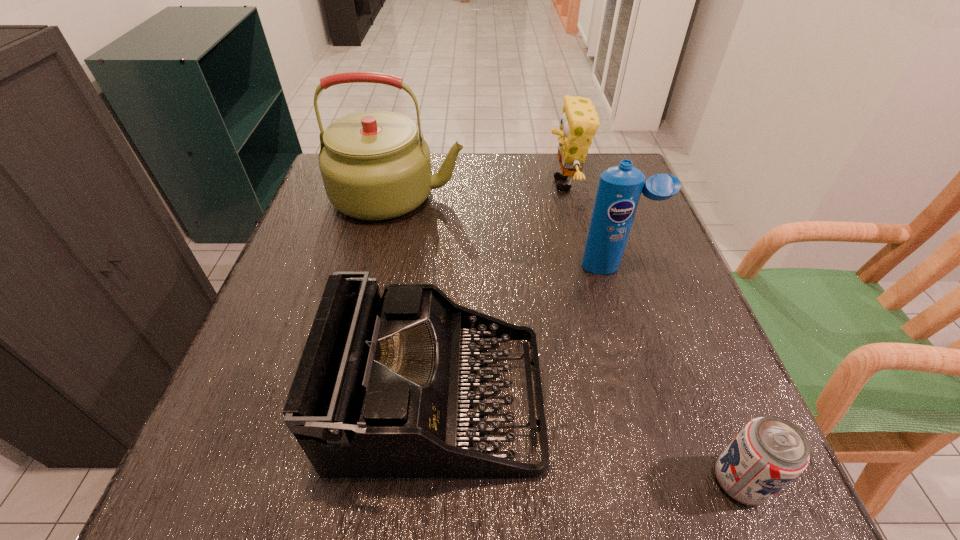
Locate an element on the screen. The width and height of the screenshot is (960, 540). the tallest object is located at coordinates pyautogui.click(x=374, y=165).

Identify the location of shampoo. The image size is (960, 540). (620, 187).

Image resolution: width=960 pixels, height=540 pixels. Identify the location of the second tallest object. (620, 187).

Where is `sponge`? The width and height of the screenshot is (960, 540). sponge is located at coordinates (579, 122).

I want to click on typewriter, so click(x=384, y=385).

At what (x,y) coordinates should I click in order to perform the action: click on beer can. Please return your answer as a coordinate pair (x, y). Looking at the image, I should click on (769, 452).

Find the location of `free region located at the spout of the kettle`. free region located at the spout of the kettle is located at coordinates (559, 195).

Locate an element on the screen. free space located 0.070m on the front of the shampoo is located at coordinates (626, 301).

Where is `free spot located 0.400m on the face of the sponge`? The image size is (960, 540). free spot located 0.400m on the face of the sponge is located at coordinates (394, 184).

Where is `vacant space located on the face of the sponge`? vacant space located on the face of the sponge is located at coordinates (492, 184).